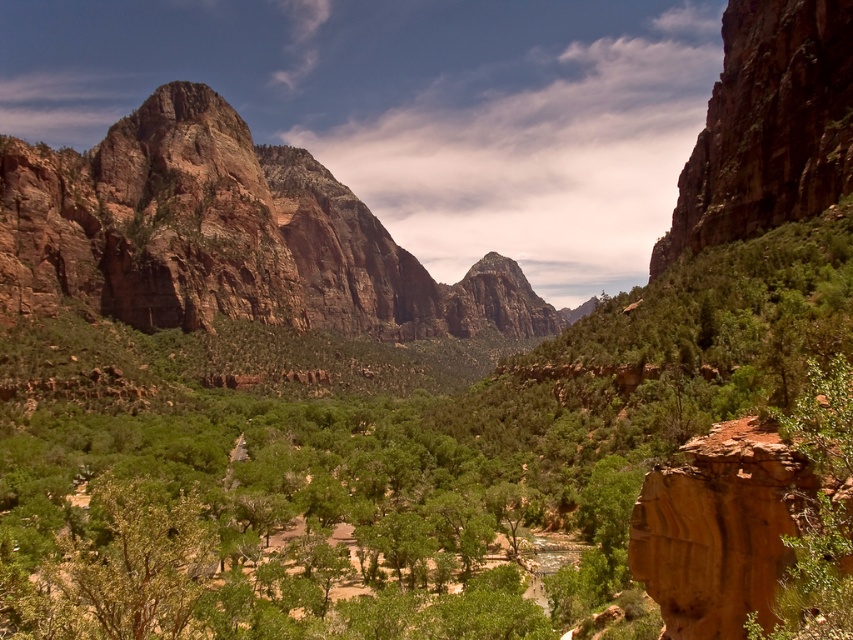
You are a geologist analyzing the canyon landscape. You observe the rustic rock formation at upper left. Can you determine its exact coordinates in the image?

The rustic rock formation at upper left is located at coordinates point (225, 236).

You are a hiker planning to take a photo of the rustic rock formation at upper left and the green leafy tree at right from the valley floor. Which object will appear larger in your photo?

The rustic rock formation at upper left will appear larger in the photo because it is much taller than the green leafy tree at right.